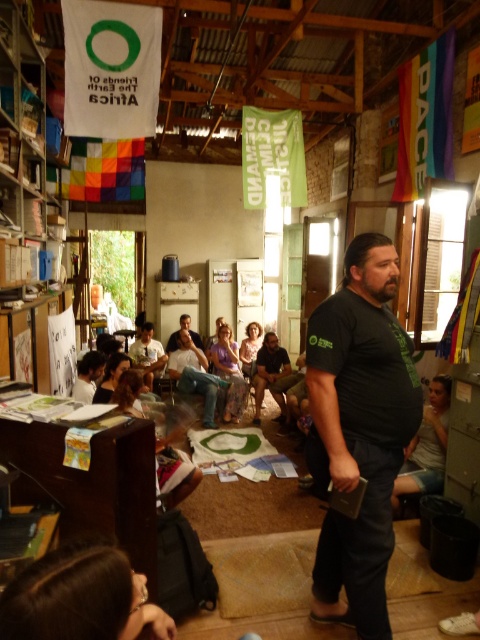
Question: Does black matte shirt at center appear under matte black shirt at center?

Choices:
 (A) no
 (B) yes

Answer: (A)

Question: Can you confirm if black matte shirt at center is smaller than light brown leather jacket at center?

Choices:
 (A) yes
 (B) no

Answer: (A)

Question: Can you confirm if black matte shirt at center is positioned below light brown leather jacket at center?

Choices:
 (A) no
 (B) yes

Answer: (A)

Question: Estimate the real-world distances between objects in this image. Which object is farther from the matte black shirt at center?

Choices:
 (A) light brown leather jacket at center
 (B) black matte shirt at center

Answer: (B)

Question: Which of the following is the farthest from the observer?

Choices:
 (A) black matte shirt at center
 (B) matte black shirt at center
 (C) light brown leather jacket at center

Answer: (B)

Question: Among these objects, which one is farthest from the camera?

Choices:
 (A) light brown leather jacket at center
 (B) matte black shirt at center
 (C) black matte shirt at center

Answer: (B)